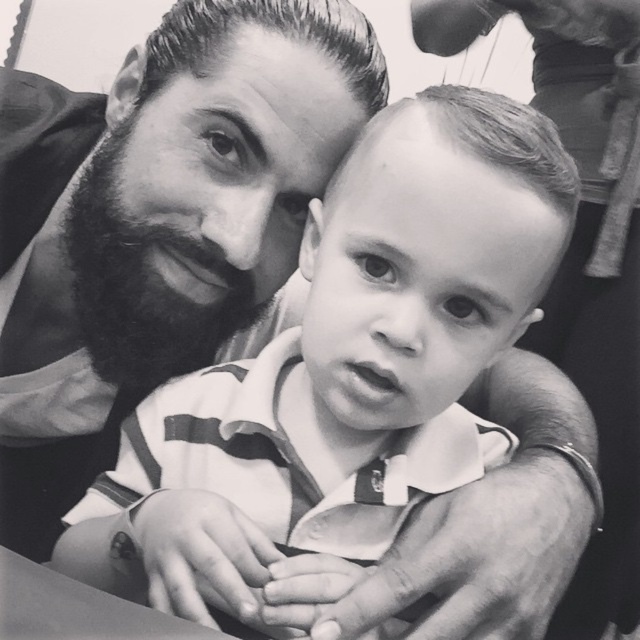
Is white striped shirt at center bigger than smooth hair at center?

No.

Is point (385, 262) positioned before point (588, 609)?

Yes, point (385, 262) is closer to viewer.

Locate an element on the screen. white striped shirt at center is located at coordinates (342, 372).

Which is below, white striped shirt at center or matte black shirt at center?

white striped shirt at center is below.

Between point (250, 406) and point (216, 234), which one is positioned in front?

Positioned in front is point (250, 406).

This screenshot has width=640, height=640. Describe the element at coordinates (342, 372) in the screenshot. I see `white striped shirt at center` at that location.

Locate an element on the screen. white striped shirt at center is located at coordinates (342, 372).

Between white striped shirt at center and beardsoft/blackbeard at left, which one appears on the right side from the viewer's perspective?

white striped shirt at center

Between point (419, 291) and point (252, 321), which one is positioned behind?

The point (252, 321) is more distant.

Does point (314, 380) come farther from viewer compared to point (218, 320)?

That is False.

Where is `white striped shirt at center`? Image resolution: width=640 pixels, height=640 pixels. white striped shirt at center is located at coordinates (342, 372).